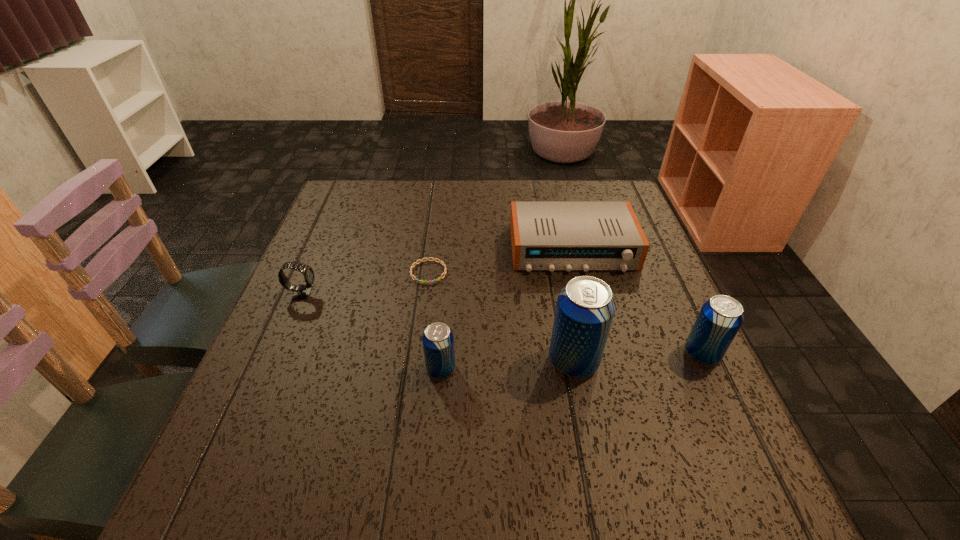
I want to click on free space located 0.060m on the back of the leftmost beer can, so click(x=444, y=334).

Where is `vacant space situated on the right of the tallest object`? The height and width of the screenshot is (540, 960). vacant space situated on the right of the tallest object is located at coordinates (674, 361).

Find the location of a particular element. This screenshot has width=960, height=540. vacant space located 0.110m on the front of the second shortest beer can is located at coordinates (732, 418).

Where is `vacant space located 0.090m on the surface of the bracelet showing star-shaped elements`? The width and height of the screenshot is (960, 540). vacant space located 0.090m on the surface of the bracelet showing star-shaped elements is located at coordinates (423, 312).

Locate an element on the screen. The width and height of the screenshot is (960, 540). free space located 0.050m on the control panel of the radio receiver is located at coordinates (583, 289).

Locate an element on the screen. This screenshot has width=960, height=540. free space located on the face of the watch is located at coordinates (473, 294).

Locate an element on the screen. object at the left edge is located at coordinates (301, 292).

The width and height of the screenshot is (960, 540). Identify the location of beer can that is positioned at the right edge. (720, 318).

You are a GUI agent. You are given a task and a screenshot of the screen. Output one action in this format:
    pyautogui.click(x=<x>, y=<y>)
    Task: Click on the radio receiver located in the right edge section of the desktop
    The image size is (960, 540).
    Given the screenshot: What is the action you would take?
    pyautogui.click(x=551, y=236)

You are a GUI agent. You are given a task and a screenshot of the screen. Output one action in this format:
    pyautogui.click(x=<x>, y=<y>)
    Task: Click on the vacant point at the far edge
    
    Given the screenshot: What is the action you would take?
    pyautogui.click(x=389, y=199)